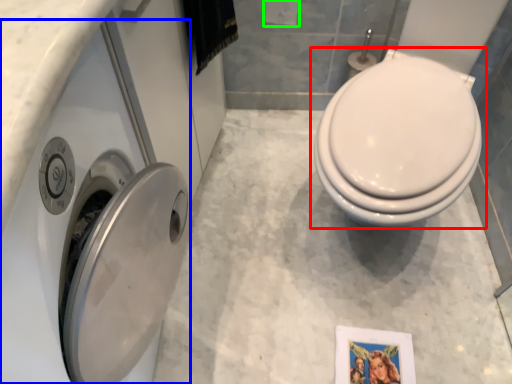
Question: Estimate the real-world distances between objects in this image. Which object is farther from toilet (highlighted by a red box), washer (highlighted by a blue box) or toilet paper (highlighted by a green box)?

Choices:
 (A) washer
 (B) toilet paper

Answer: (B)